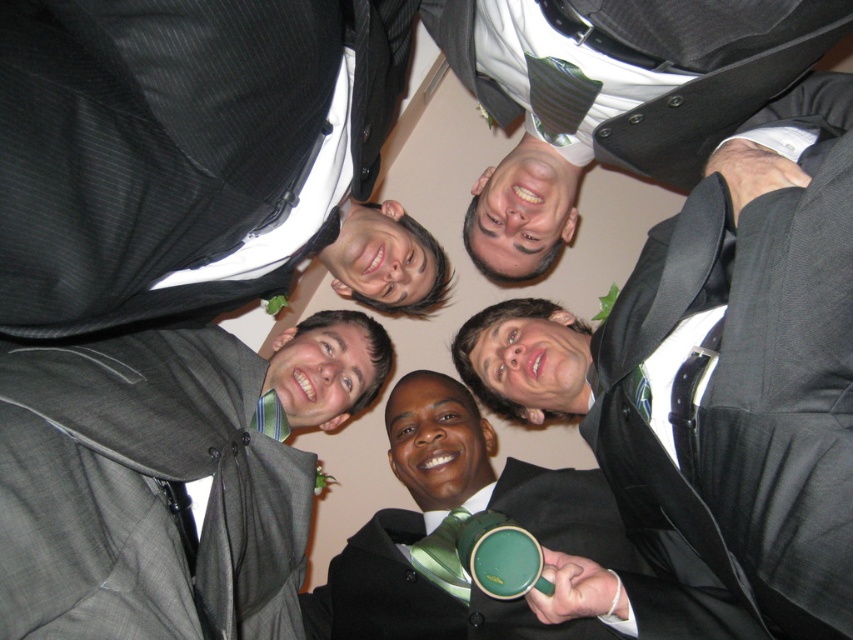
Who is more forward, [799,100] or [596,499]?

Point [799,100] is in front.

In the scene shown: Who is more distant from viewer, (605, 92) or (555, 524)?

Positioned behind is point (555, 524).

Does point (834, 116) lie in front of point (590, 538)?

Yes, it is.

The image size is (853, 640). I want to click on matte black suit at upper center, so click(x=633, y=102).

Describe the element at coordinates (166, 480) in the screenshot. This screenshot has width=853, height=640. I see `matte gray suit at upper left` at that location.

Who is positioned more to the right, matte gray suit at upper left or green striped tie at center?

From the viewer's perspective, green striped tie at center appears more on the right side.

Which is behind, point (189, 618) or point (445, 573)?

Point (445, 573)

You are a GUI agent. You are given a task and a screenshot of the screen. Output one action in this format:
    pyautogui.click(x=<x>, y=<y>)
    Task: Click on the matte gray suit at upper left
    
    Given the screenshot: What is the action you would take?
    pyautogui.click(x=166, y=480)

Does shiny black suit at center have a smaller size compared to matte black suit at upper center?

No.

Is shiny black suit at center wider than matte black suit at upper center?

Incorrect, shiny black suit at center's width does not surpass matte black suit at upper center's.

Is point (675, 572) behind point (838, 86)?

Yes, it is behind point (838, 86).

Locate an element on the screen. The height and width of the screenshot is (640, 853). shiny black suit at center is located at coordinates (711, 403).